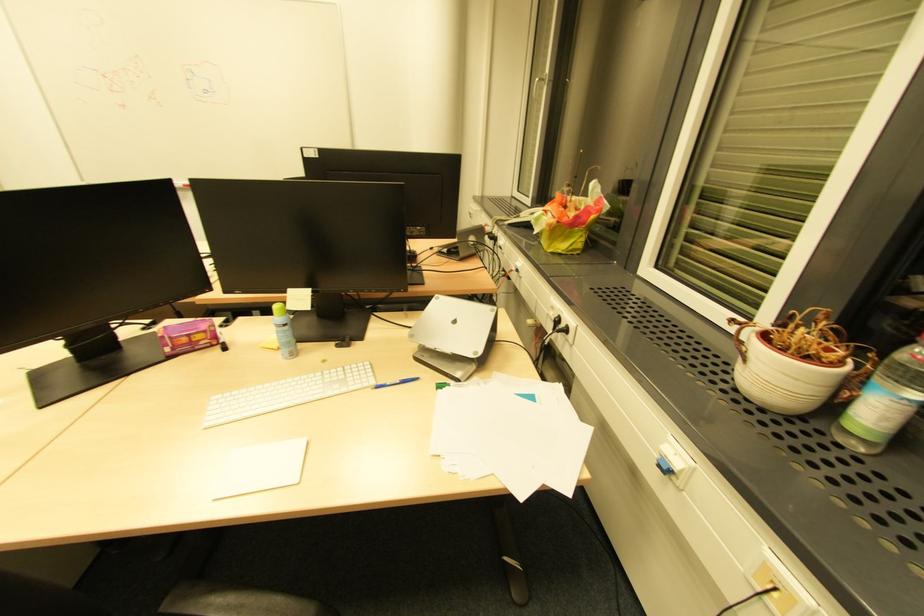
This screenshot has width=924, height=616. I want to click on blue wall switch, so click(x=663, y=464).